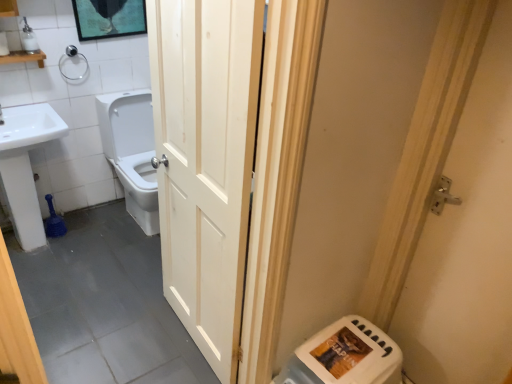
Identify the location of vacant space to the right of white ceramic sink at left. (106, 254).